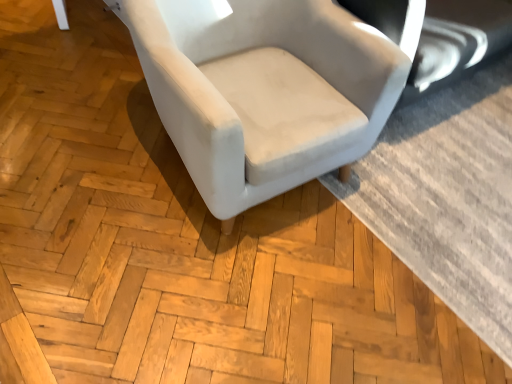
The image size is (512, 384). Identify the location of white velvet chair at center. (266, 96).

In order to face white velvet chair at center, should I rotate leftwards or rightwards?

To align with it, rotate left about 0.211°.

What do you see at coordinates (266, 96) in the screenshot? I see `white velvet chair at center` at bounding box center [266, 96].

Locate an element on the screen. This screenshot has width=512, height=384. white velvet chair at center is located at coordinates (266, 96).